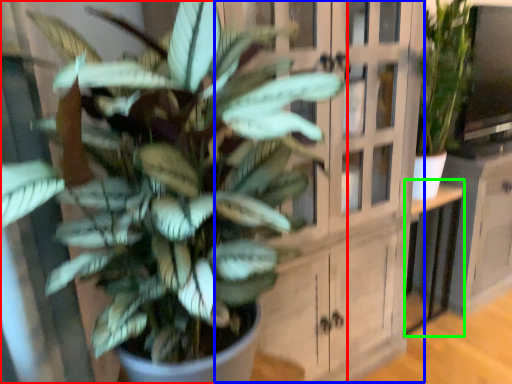
Question: Considering the real-world distances, which object is closest to houseplant (highlighted by a red box)? dresser (highlighted by a blue box) or table (highlighted by a green box).

Choices:
 (A) dresser
 (B) table

Answer: (A)